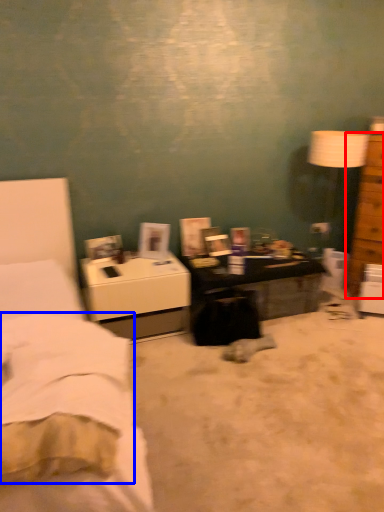
Question: Which point is further to the camera, chest of drawers (highlighted by a red box) or sheet (highlighted by a blue box)?

Choices:
 (A) chest of drawers
 (B) sheet

Answer: (A)